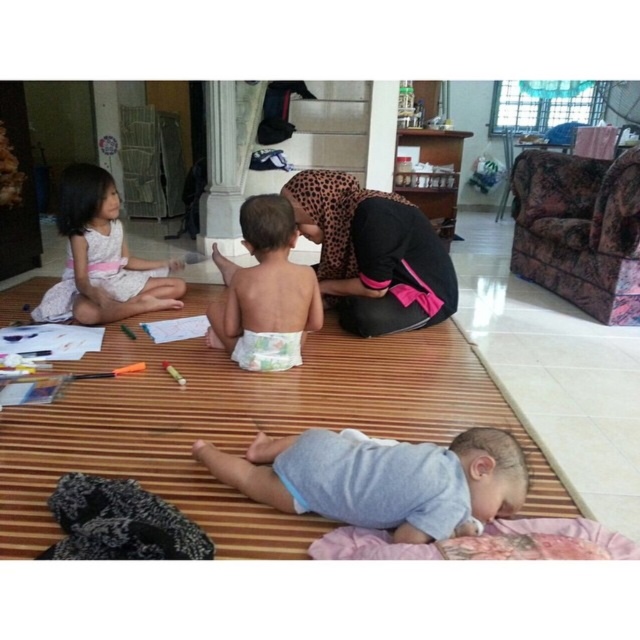
Question: Considering the relative positions of leopard print headscarf at center and white cotton dress at upper left in the image provided, where is leopard print headscarf at center located with respect to white cotton dress at upper left?

Choices:
 (A) left
 (B) right

Answer: (B)

Question: Which point is closer to the camera taking this photo?

Choices:
 (A) (493, 461)
 (B) (243, 353)
 (C) (276, 225)

Answer: (A)

Question: Which point is farther to the camera?

Choices:
 (A) (371, 515)
 (B) (99, 256)

Answer: (B)

Question: Does leopard print headscarf at center come in front of white cotton dress at upper left?

Choices:
 (A) yes
 (B) no

Answer: (A)

Question: Is light brown diaper at center further to camera compared to white soft diaper at center?

Choices:
 (A) yes
 (B) no

Answer: (B)

Question: Which point is closer to the camera?

Choices:
 (A) light blue fabric at center
 (B) light brown diaper at center
 (C) white cotton dress at upper left
 (D) leopard print headscarf at center

Answer: (A)